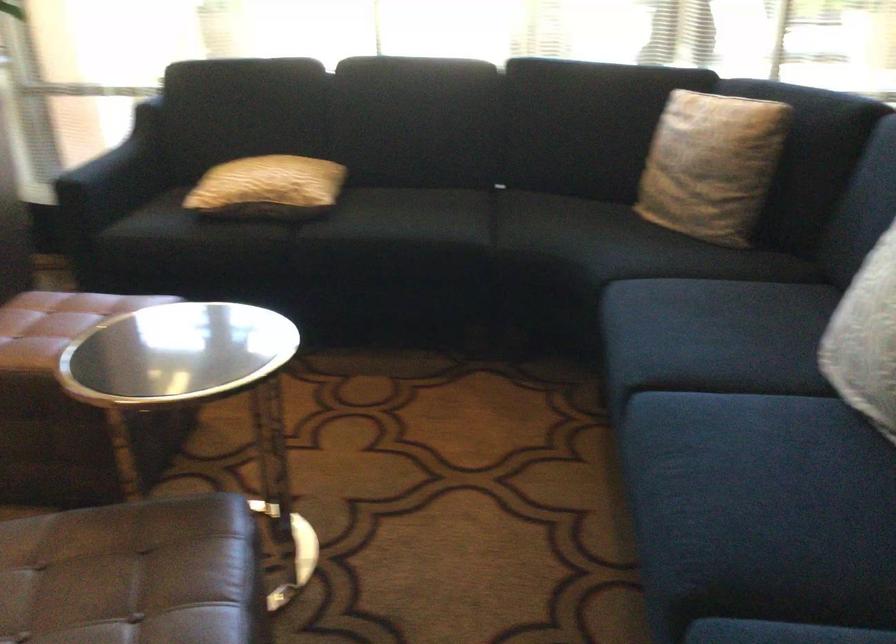
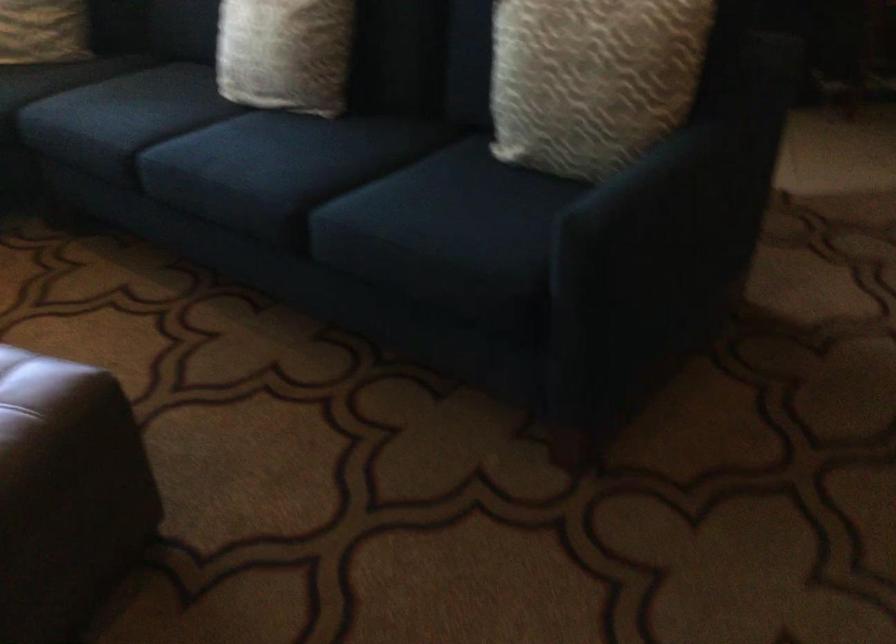
The point at (728, 464) is marked in the first image. Where is the corresponding point in the second image?

(245, 154)